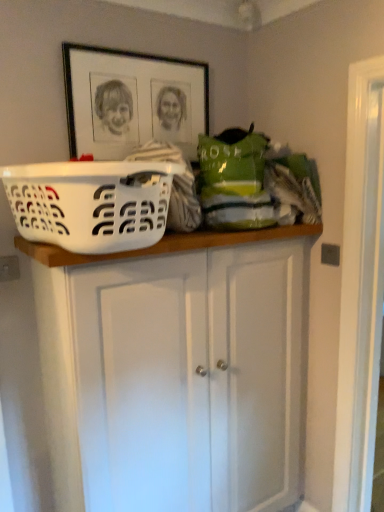
Image resolution: width=384 pixels, height=512 pixels. I want to click on empty space that is ontop of white painted wood cabinet at upper center (from a real-world perspective), so click(221, 231).